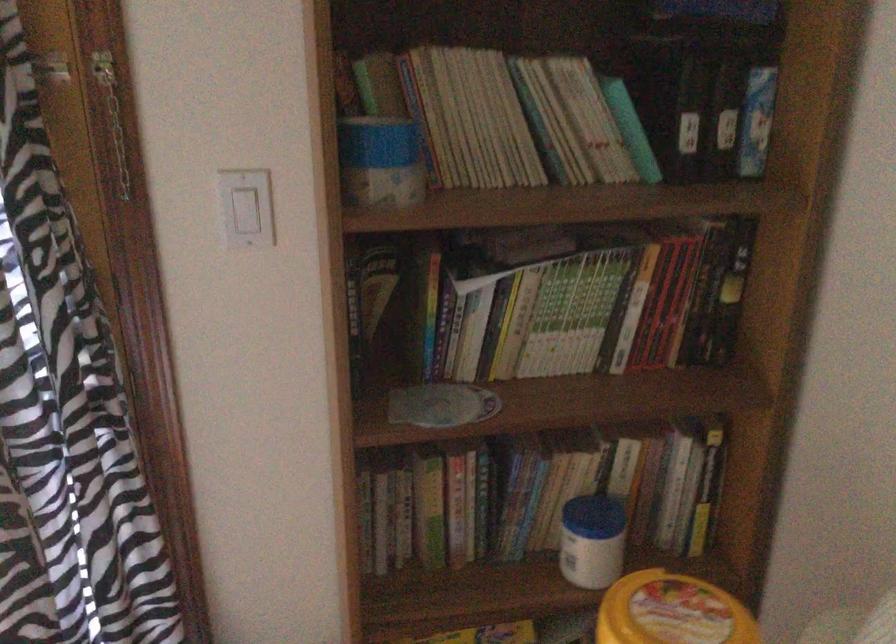
Describe the element at coordinates (593, 516) in the screenshot. I see `the blue jar lid` at that location.